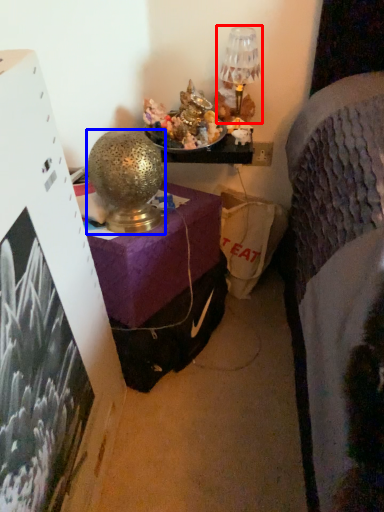
Question: Which object appears farthest to the camera in this image, table lamp (highlighted by a red box) or table lamp (highlighted by a blue box)?

Choices:
 (A) table lamp
 (B) table lamp

Answer: (A)